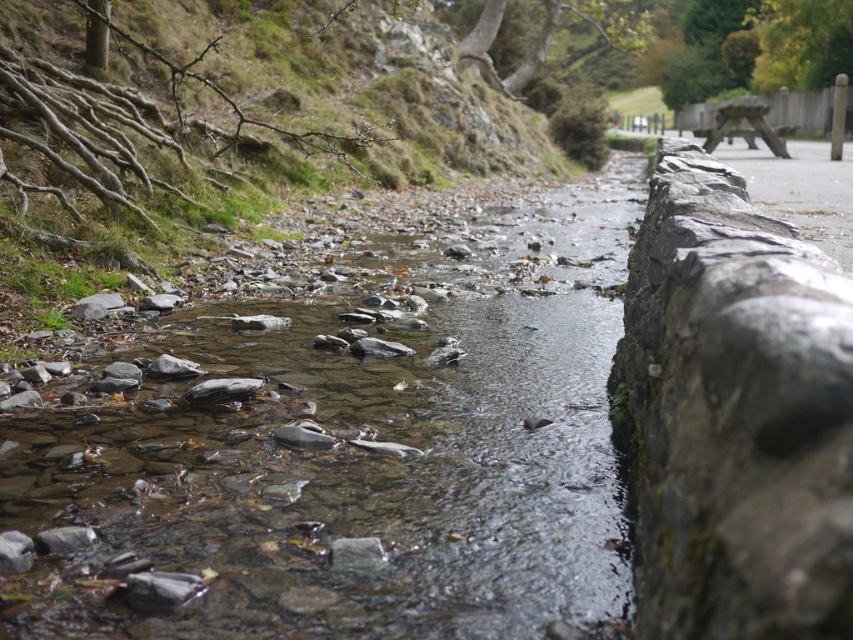
You are planning to cross the stream using the path next to the gray stone wall at right. Based on the scene, can you determine if the clear water at center will be a challenge for your journey?

The clear water at center occupies less space than the gray stone wall at right, so the stream is narrower there. This means the clear water at center is a narrower section, making it easier to cross without obstacles from the gray stone wall at right.

You are a hiker trying to cross the stream. You see the clear water at center and the gray stone wall at right. Which object is closer to you as you stand on the path next to the wall?

The clear water at center is closer to you than the gray stone wall at right because the gray stone wall at right is behind the clear water at center.